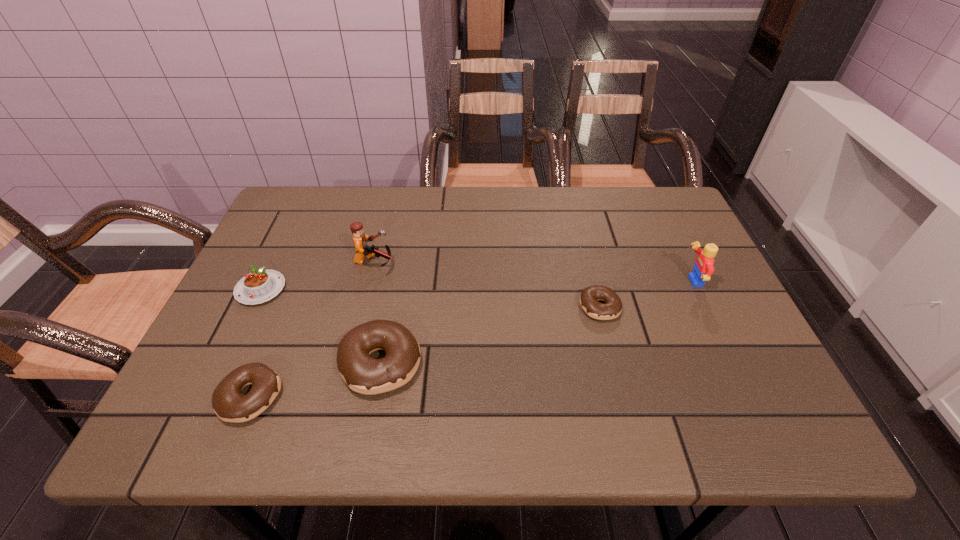
Find the location of a particular element. This screenshot has height=540, width=960. vacant space at the far edge is located at coordinates (526, 193).

Identify the location of vacant area at the near edge. The image size is (960, 540). (492, 392).

The height and width of the screenshot is (540, 960). In order to click on free space at the right edge in this screenshot , I will do `click(687, 315)`.

This screenshot has height=540, width=960. Find the location of `free space at the far left corner of the desktop`. free space at the far left corner of the desktop is located at coordinates (296, 195).

The image size is (960, 540). Find the location of `free region at the far right corner`. free region at the far right corner is located at coordinates (652, 204).

In the image, there is a desktop. Identify the location of vacant region at the near right corner. The width and height of the screenshot is (960, 540). (734, 393).

Where is `vacant point located between the shortest object and the tallest doughnut`? Image resolution: width=960 pixels, height=540 pixels. vacant point located between the shortest object and the tallest doughnut is located at coordinates (491, 335).

At what (x,y) coordinates should I click in order to perform the action: click on vacant area that lies between the pudding and the leftmost doughnut. Please return your answer as a coordinate pair (x, y). Image resolution: width=960 pixels, height=540 pixels. Looking at the image, I should click on (255, 343).

Locate an element on the screen. free spot between the pudding and the third tallest object is located at coordinates (321, 326).

Where is `unoccupied area between the right Lego and the second tallest doughnut`? unoccupied area between the right Lego and the second tallest doughnut is located at coordinates (471, 339).